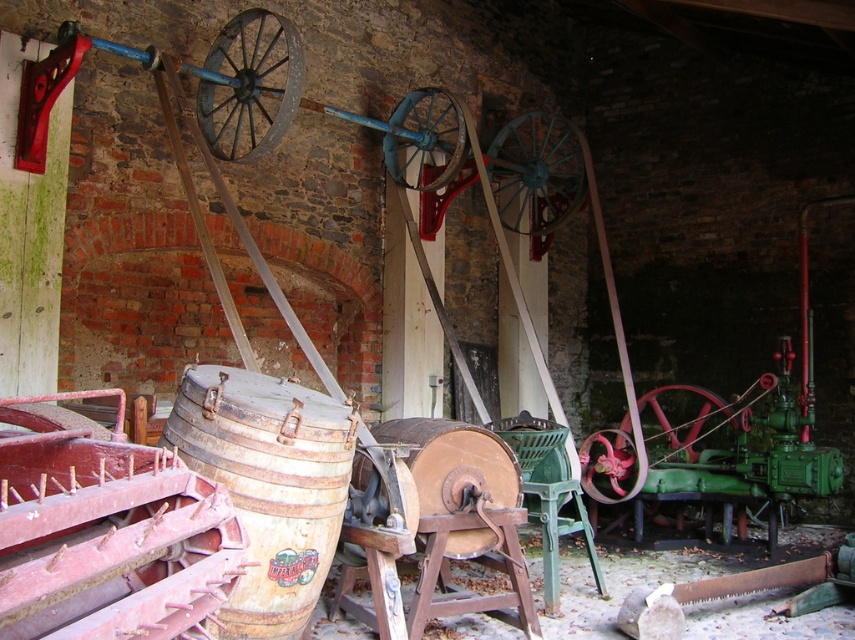
You are a maintenance worker who needs to move a 3.0 meter long ladder from the storage room to the space between the rusty metal wheel at center and the metallic red wheel at center. Can the ladder fit in the space between them?

The distance between the rusty metal wheel at center and the metallic red wheel at center is 3.01 meters. Since the ladder is 3.0 meters long, it can fit in the space between them with a small amount of clearance.

You are standing in front of the vintage machinery display and want to walk from the point at coordinates point (440,140) to the point at point (600,497). Which direction should you move to get closer to your destination?

To move from point (440,140) to point (600,497), you should move towards the upper right direction since point (600,497) is located at a higher x and y coordinate compared to point (440,140).